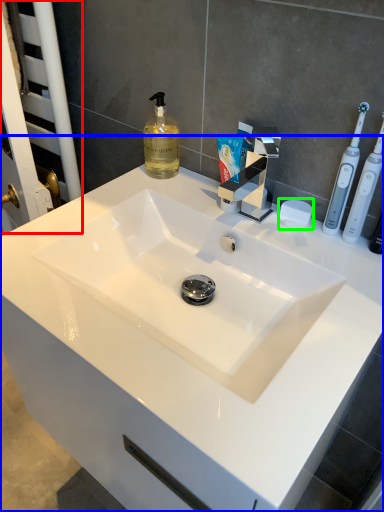
Question: Which is nearer to the screen door (highlighted by a red box)? sink (highlighted by a blue box) or soap (highlighted by a green box).

Choices:
 (A) sink
 (B) soap

Answer: (A)